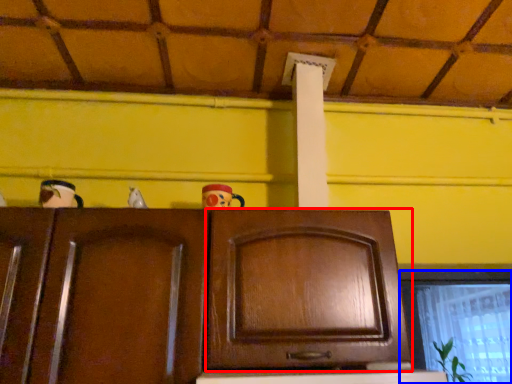
Question: Which object appears farthest to the camera in this image, cabinetry (highlighted by a red box) or window (highlighted by a blue box)?

Choices:
 (A) cabinetry
 (B) window

Answer: (B)